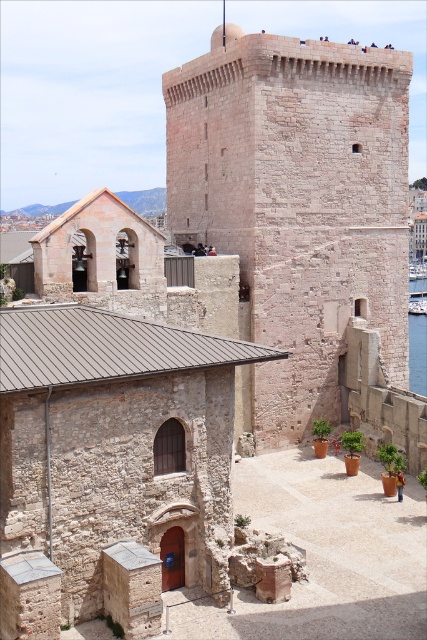
Can you confirm if rustic stone tower at center is positioned to the left of clear blue water at right?

Correct, you'll find rustic stone tower at center to the left of clear blue water at right.

Can you confirm if rustic stone tower at center is taller than clear blue water at right?

Correct, rustic stone tower at center is much taller as clear blue water at right.

Where is `rustic stone tower at center`? The width and height of the screenshot is (427, 640). rustic stone tower at center is located at coordinates (297, 205).

At what (x,y) coordinates should I click in order to perform the action: click on rustic stone tower at center. Please return your answer as a coordinate pair (x, y). The image size is (427, 640). Looking at the image, I should click on (297, 205).